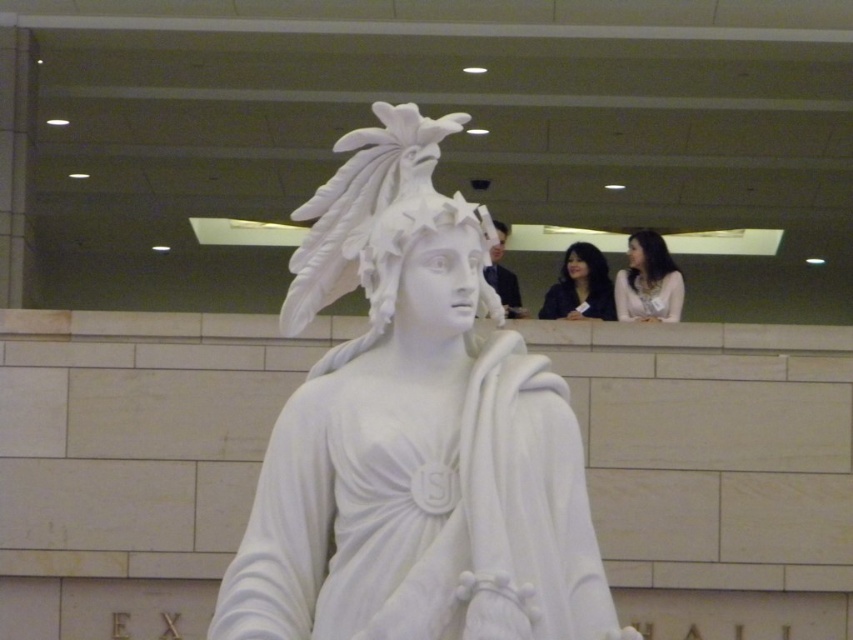
Question: Can you confirm if smooth white blouse at upper right is smaller than dark blue fabric at upper center?

Choices:
 (A) yes
 (B) no

Answer: (A)

Question: Which object appears closest to the camera in this image?

Choices:
 (A) dark blue fabric at upper center
 (B) white marble statue at center

Answer: (B)

Question: Which object appears closest to the camera in this image?

Choices:
 (A) white marble statue at center
 (B) smooth white blouse at upper right
 (C) dark blue fabric at upper center

Answer: (A)

Question: Is white marble statue at center above smooth white blouse at upper right?

Choices:
 (A) no
 (B) yes

Answer: (A)

Question: Among these points, which one is farthest from the camera?

Choices:
 (A) pyautogui.click(x=653, y=273)
 (B) pyautogui.click(x=544, y=310)

Answer: (B)

Question: Does white marble statue at center have a lesser width compared to smooth white blouse at upper right?

Choices:
 (A) no
 (B) yes

Answer: (A)